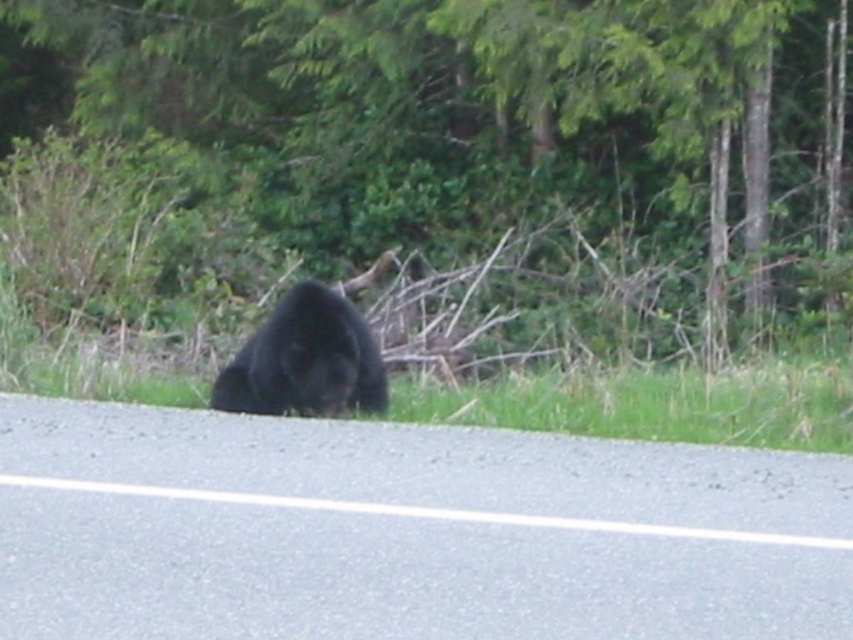
In the image of the black bear on the road, there is a point marked at coordinates (x=442, y=157). Which object from the scene is exactly at that location?

The green leafy tree at center is located at point (x=442, y=157).

You are a hiker trying to estimate the sizes of objects in the scene. Which object, the green leafy tree at center or the black fur bear at center, has a larger width?

The green leafy tree at center might be wider than black fur bear at center.